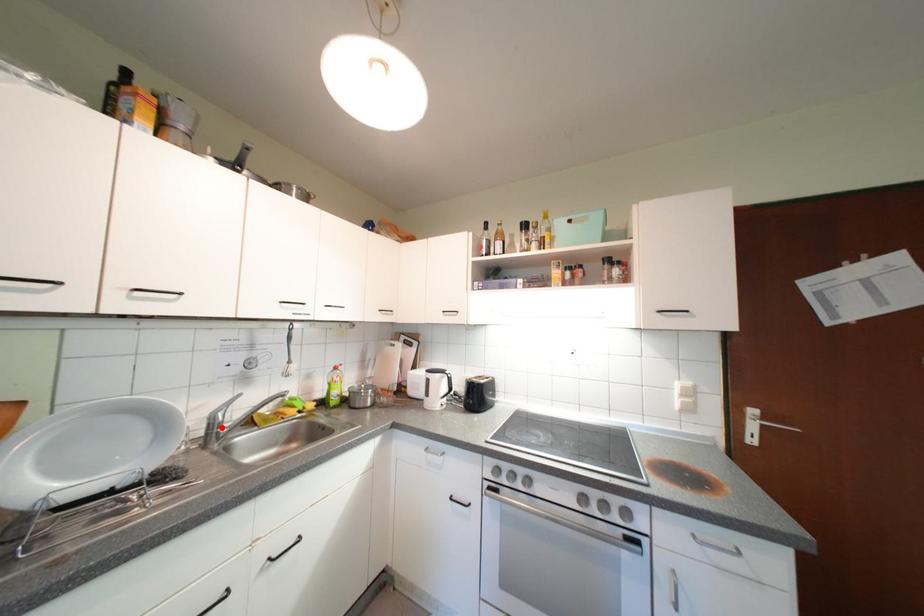
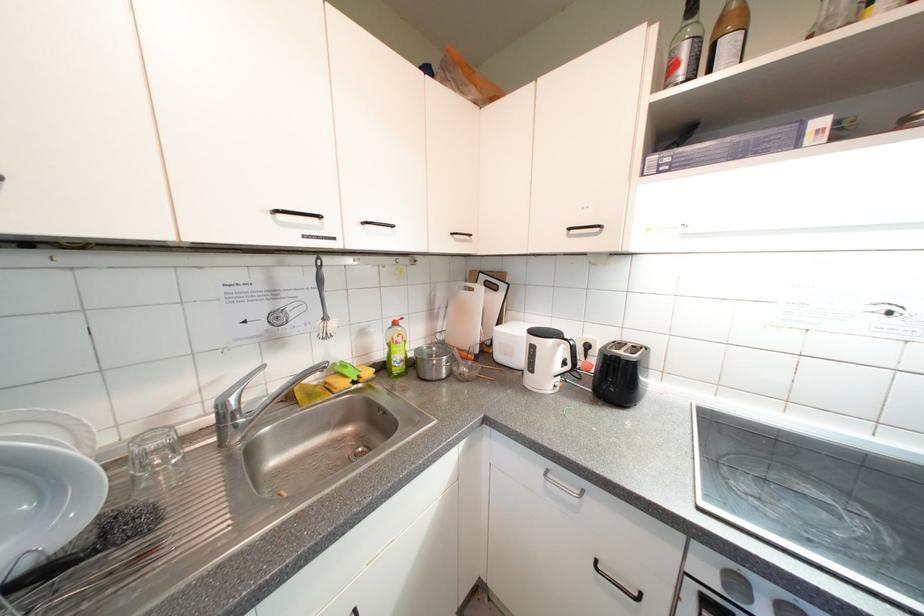
Where in the second image is the point corresponding to the highlighted location from the first image?

(233, 419)